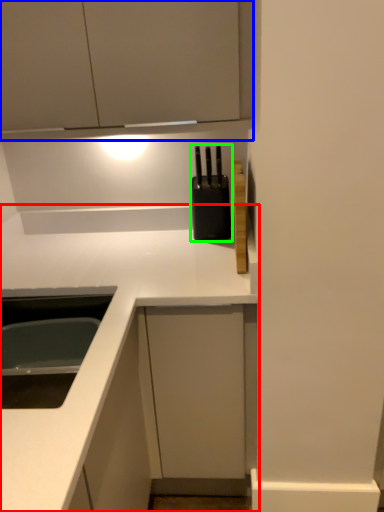
Question: Based on their relative distances, which object is farther from countertop (highlighted by a red box)? Choose from cabinetry (highlighted by a blue box) and appliance (highlighted by a green box).

Choices:
 (A) cabinetry
 (B) appliance

Answer: (A)